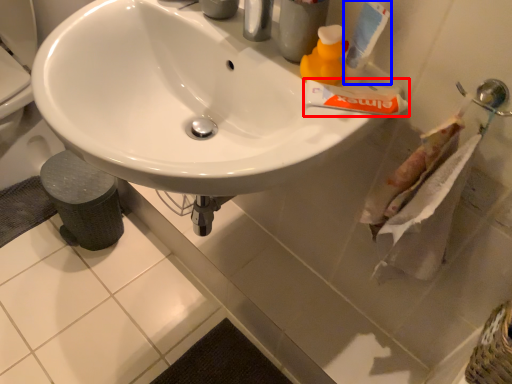
Question: Which object is closer to the camera taking this photo, toothpaste (highlighted by a red box) or toothpaste (highlighted by a blue box)?

Choices:
 (A) toothpaste
 (B) toothpaste

Answer: (B)